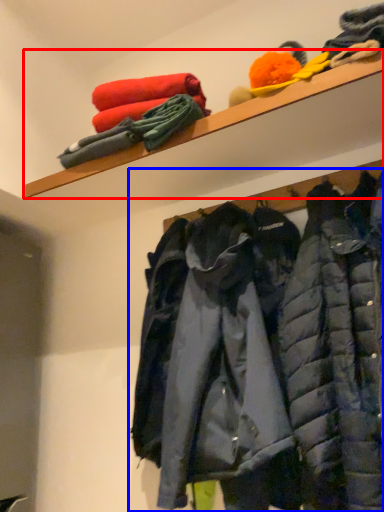
Question: Which of the following is the closest to the observer, shelf (highlighted by a red box) or jacket (highlighted by a blue box)?

Choices:
 (A) shelf
 (B) jacket

Answer: (B)